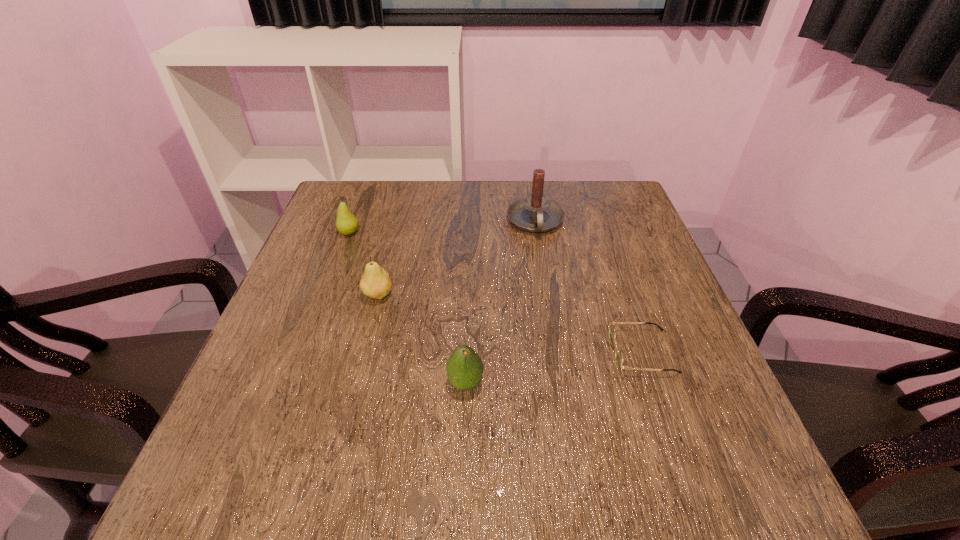
Identify the location of the tallest object. (535, 213).

Locate an element on the screen. The height and width of the screenshot is (540, 960). the fourth object from left to right is located at coordinates (535, 213).

This screenshot has height=540, width=960. What are the coordinates of `the left pear` in the screenshot? It's located at (346, 223).

Identify the location of the farther pear. The image size is (960, 540). (346, 223).

Find the location of `the right pear`. the right pear is located at coordinates (375, 283).

Identify the location of the nearer pear. (375, 283).

Where is `the third object from right to left`? The width and height of the screenshot is (960, 540). the third object from right to left is located at coordinates (464, 367).

Find the location of a particular element. The height and width of the screenshot is (540, 960). spectacles is located at coordinates (618, 352).

Find the location of a particular element. This screenshot has width=960, height=540. the rightmost object is located at coordinates (618, 352).

Find the location of `free location located 0.340m on the side of the candle with the handle loop`. free location located 0.340m on the side of the candle with the handle loop is located at coordinates (555, 345).